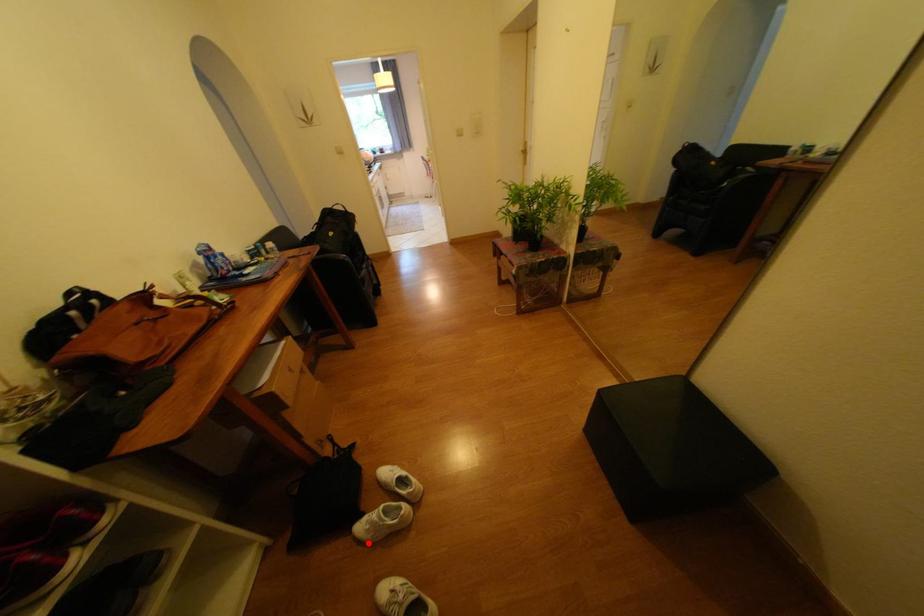
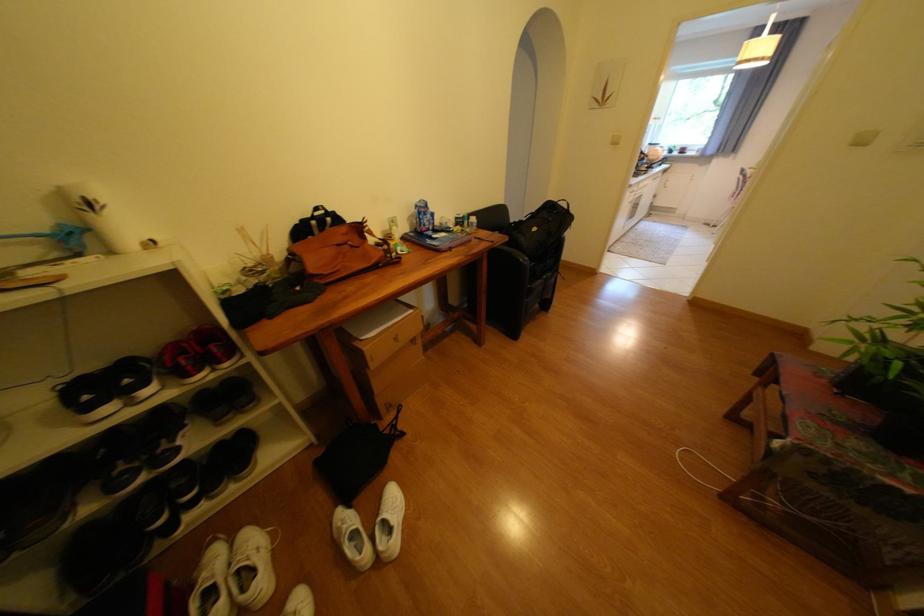
In the second image, find the point that corresponds to the highlighted location in the first image.

(342, 524)